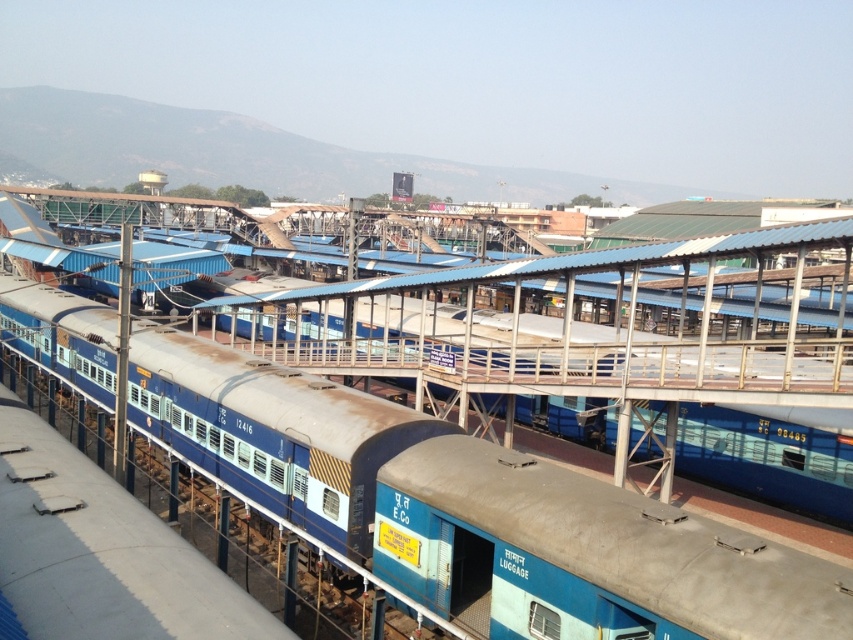
Question: Which point appears closest to the camera in this image?

Choices:
 (A) (48, 346)
 (B) (670, 506)

Answer: (B)

Question: Is blue painted metal train car at center closer to the viewer compared to blue matte luggage at center?

Choices:
 (A) yes
 (B) no

Answer: (B)

Question: Can you confirm if blue painted metal train car at center is positioned to the right of blue matte luggage at center?

Choices:
 (A) yes
 (B) no

Answer: (B)

Question: Which point is farther to the camera?

Choices:
 (A) blue painted metal train car at center
 (B) blue matte luggage at center

Answer: (A)

Question: Is blue painted metal train car at center below blue matte luggage at center?

Choices:
 (A) yes
 (B) no

Answer: (B)